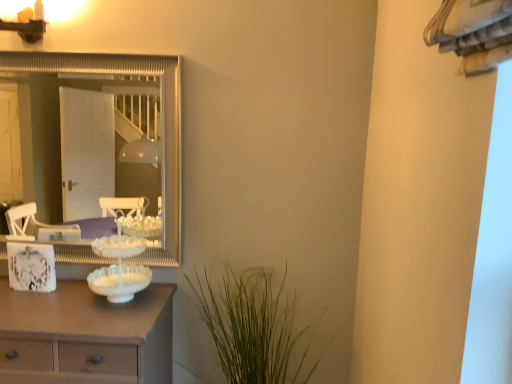
In order to click on blank space situated above white wood chest of drawers at left (from a real-world perspective) in this screenshot , I will do `click(60, 305)`.